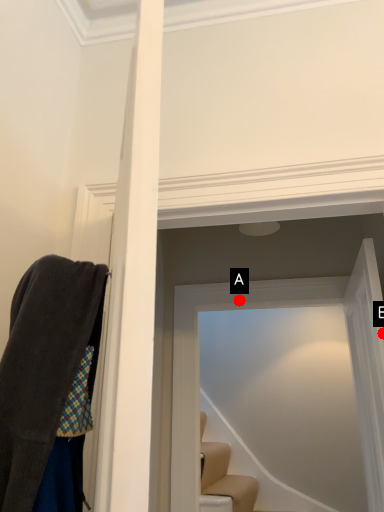
Question: Two points are circled on the image, labeled by A and B beside each circle. Which of the following is the farthest from the observer?

Choices:
 (A) A is further
 (B) B is further

Answer: (A)